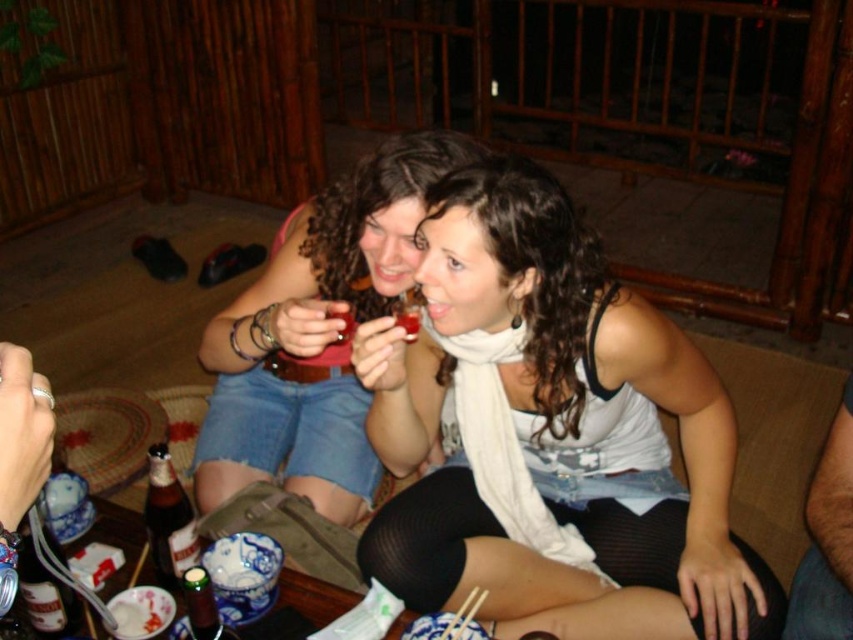
You are at a party and want to grab a drink. You see a brown glass bottle at lower left and a matte plastic cup at center. Which one is closer to your left side?

The brown glass bottle at lower left is to the left of matte plastic cup at center, so it is closer to your left side.

You are a photographer setting up a shot of the two women. You want to ensure the white matte scarf at center and the matte plastic cup at center are both in focus. Since you can only focus on one object at a time, which one should you focus on first to ensure the other is also in focus?

The white matte scarf at center is located below the matte plastic cup at center. Since the scarf is lower, focusing on the cup first would naturally include the scarf in the depth of field, ensuring both are in focus.